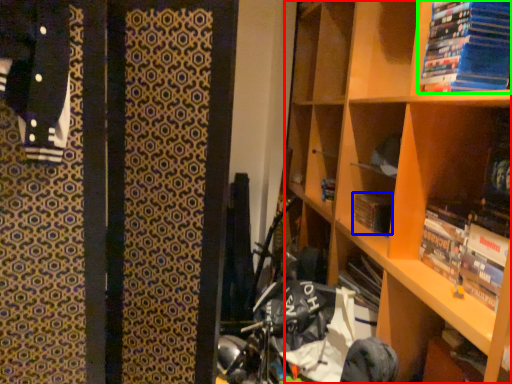
Question: Which is nearer to the shelf (highlighted by a red box)? paperback book (highlighted by a blue box) or book (highlighted by a green box).

Choices:
 (A) paperback book
 (B) book

Answer: (B)